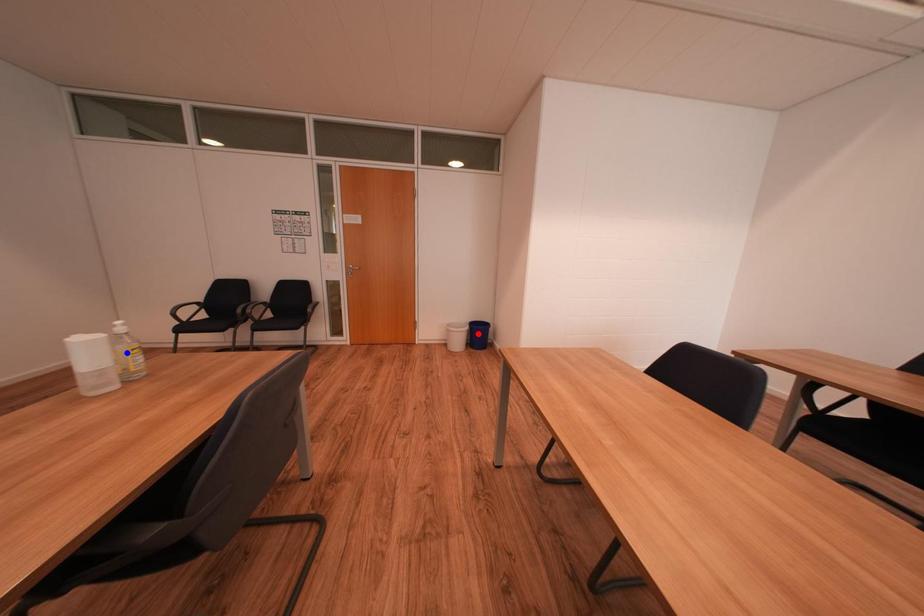
Question: In the image, two points are highlighted. Which point is nearer to the camera? Reply with the corresponding letter.

Choices:
 (A) blue point
 (B) red point

Answer: (A)